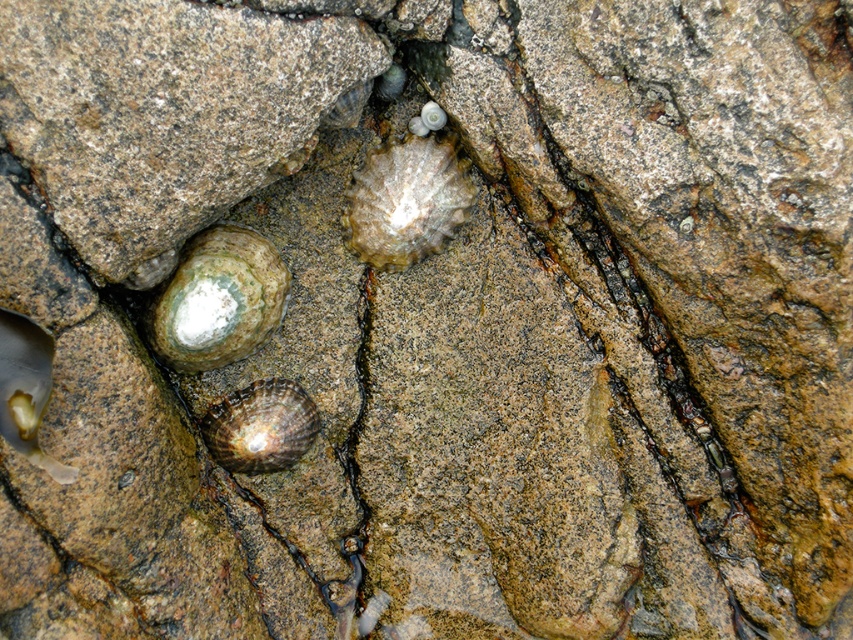
Question: Based on their relative distances, which object is farther from the greenish-brown stone at lower left?

Choices:
 (A) shiny brown shell at center
 (B) translucent brown shell at center

Answer: (B)

Question: Does greenish-brown stone at lower left appear over shiny brown shell at center?

Choices:
 (A) yes
 (B) no

Answer: (A)

Question: Which object is positioned farthest from the greenish-brown stone at lower left?

Choices:
 (A) shiny brown shell at center
 (B) translucent brown shell at center

Answer: (B)

Question: Can you confirm if greenish-brown stone at lower left is smaller than shiny brown shell at center?

Choices:
 (A) yes
 (B) no

Answer: (B)

Question: Is greenish-brown stone at lower left bigger than shiny brown shell at center?

Choices:
 (A) no
 (B) yes

Answer: (B)

Question: Which point is closer to the camera?

Choices:
 (A) greenish-brown stone at lower left
 (B) shiny brown shell at center

Answer: (A)